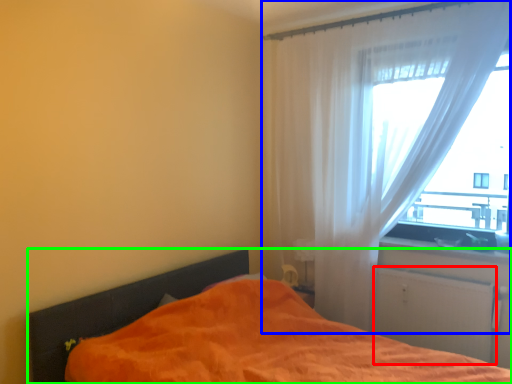
Question: Which object is the closest to the screen door (highlighted by a red box)? Choose among these: curtain (highlighted by a blue box) or bed (highlighted by a green box).

Choices:
 (A) curtain
 (B) bed

Answer: (A)